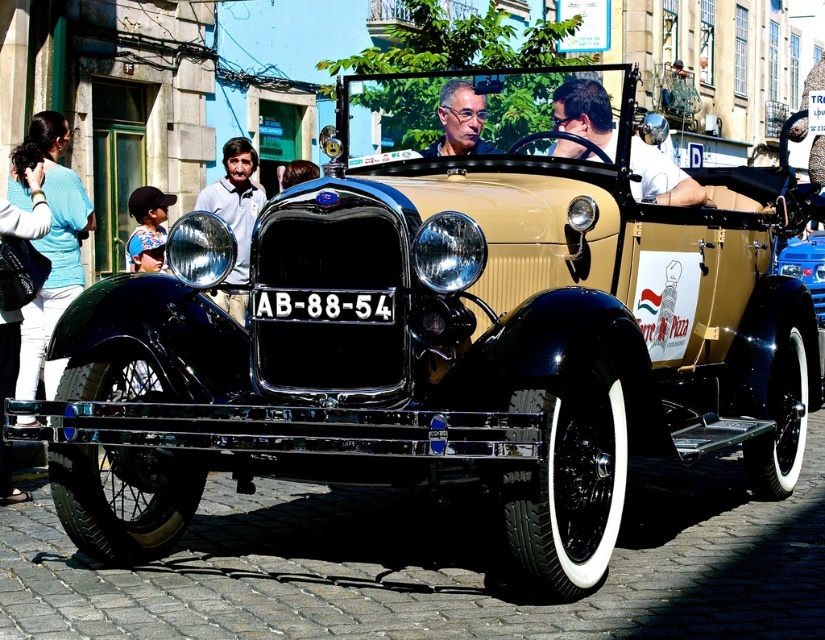
Which is more to the left, matte black shirt at center or matte black face at center?

From the viewer's perspective, matte black face at center appears more on the left side.

How much distance is there between matte black shirt at center and matte black face at center?

The distance of matte black shirt at center from matte black face at center is 35.81 inches.

Is point (564, 90) behind point (474, 140)?

No, it is in front of (474, 140).

The image size is (825, 640). What are the coordinates of `matte black shirt at center` in the screenshot? It's located at (583, 113).

Is point (637, 184) behind point (821, 275)?

No, it is in front of (821, 275).

Which is in front, point (613, 147) or point (819, 317)?

Point (613, 147) is more forward.

Which is in front, point (673, 193) or point (788, 243)?

Point (673, 193)

Where is `matte black shirt at center`? matte black shirt at center is located at coordinates (583, 113).

Between matte white shirt at center and matte black face at center, which one is positioned lower?

Positioned lower is matte white shirt at center.

Which of these two, matte white shirt at center or matte black face at center, stands shorter?

Standing shorter between the two is matte black face at center.

Does point (219, 184) come in front of point (451, 140)?

No.

Locate an element on the screen. Image resolution: width=825 pixels, height=640 pixels. matte white shirt at center is located at coordinates (234, 200).